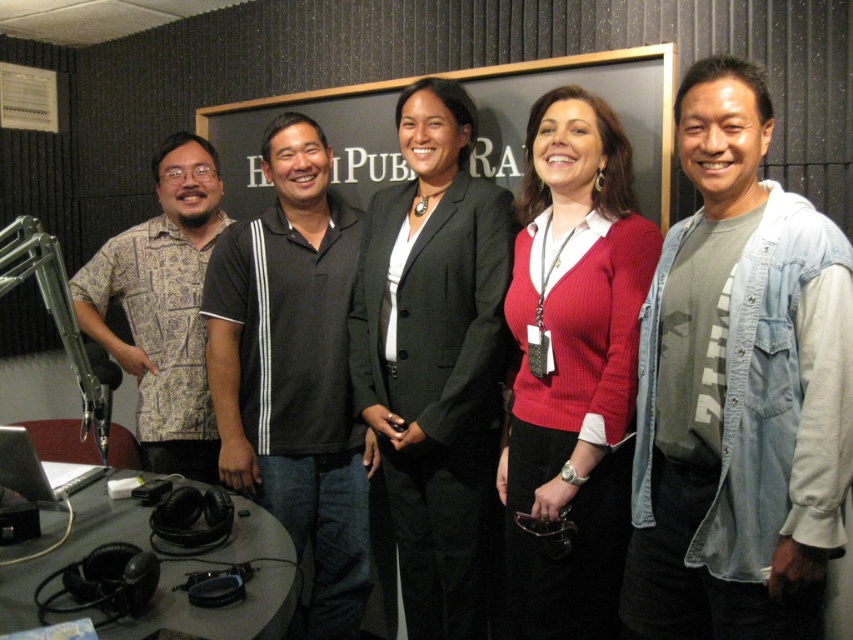
Question: Among these objects, which one is farthest from the camera?

Choices:
 (A) patterned fabric shirt at left
 (B) denim jacket at right

Answer: (A)

Question: Which of these objects is positioned closest to the blackboard at center?

Choices:
 (A) ribbed sweater at center
 (B) matte black blazer at center

Answer: (B)

Question: Can you confirm if black polo shirt at center is wider than patterned fabric shirt at left?

Choices:
 (A) yes
 (B) no

Answer: (B)

Question: Which point is closer to the camera?

Choices:
 (A) matte black blazer at center
 (B) ribbed sweater at center
 (C) denim jacket at right

Answer: (C)

Question: Is ribbed sweater at center below blackboard at center?

Choices:
 (A) no
 (B) yes

Answer: (B)

Question: Can you confirm if denim jacket at right is thinner than blackboard at center?

Choices:
 (A) yes
 (B) no

Answer: (A)